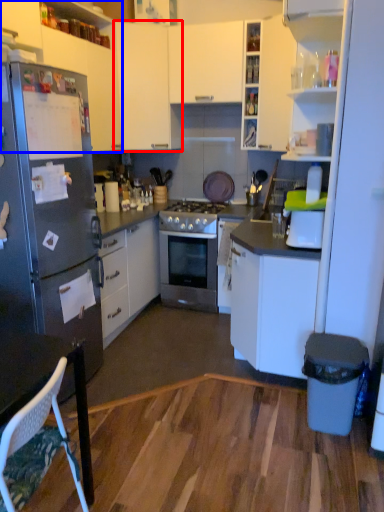
Question: Which object is further to the camera taking this photo, cabinetry (highlighted by a red box) or cabinetry (highlighted by a blue box)?

Choices:
 (A) cabinetry
 (B) cabinetry

Answer: (A)